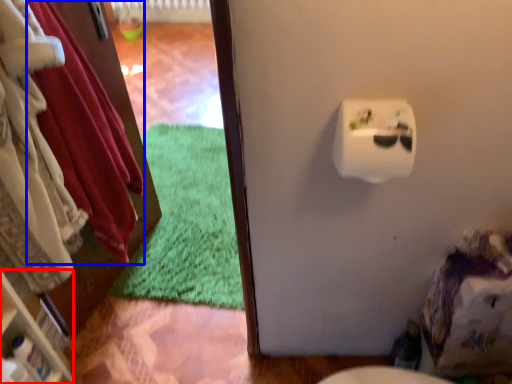
Question: Which of the following is the farthest to the observer, shelf (highlighted by a red box) or clothing (highlighted by a blue box)?

Choices:
 (A) shelf
 (B) clothing

Answer: (A)